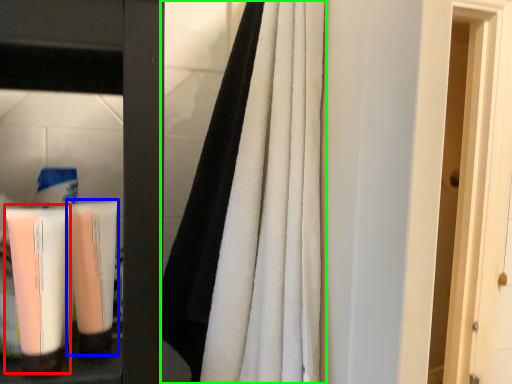
Question: Which is nearer to the cleaning product (highlighted by a red box)? shaving cream (highlighted by a blue box) or curtain (highlighted by a green box).

Choices:
 (A) shaving cream
 (B) curtain

Answer: (A)